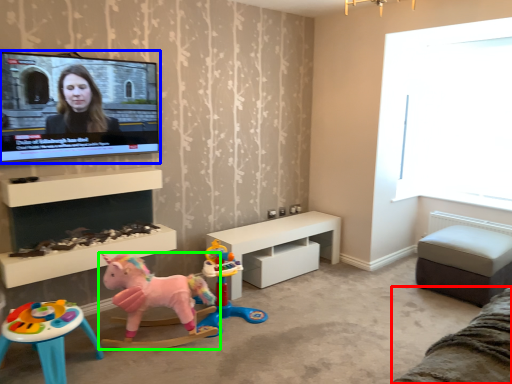
Question: Estimate the real-world distances between objects in this image. Which object is farther from couch (highlighted by a red box), television (highlighted by a blue box) or toy (highlighted by a green box)?

Choices:
 (A) television
 (B) toy

Answer: (A)